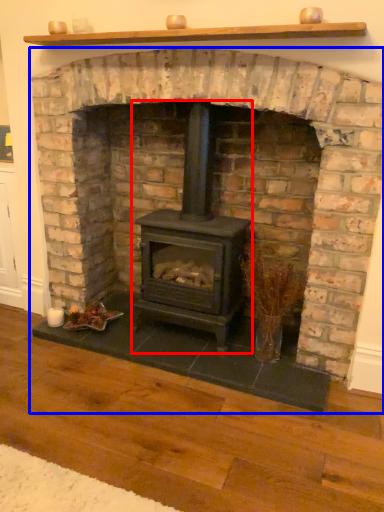
Question: Which object appears farthest to the camera in this image, wood burning stove (highlighted by a red box) or fireplace (highlighted by a blue box)?

Choices:
 (A) wood burning stove
 (B) fireplace

Answer: (A)